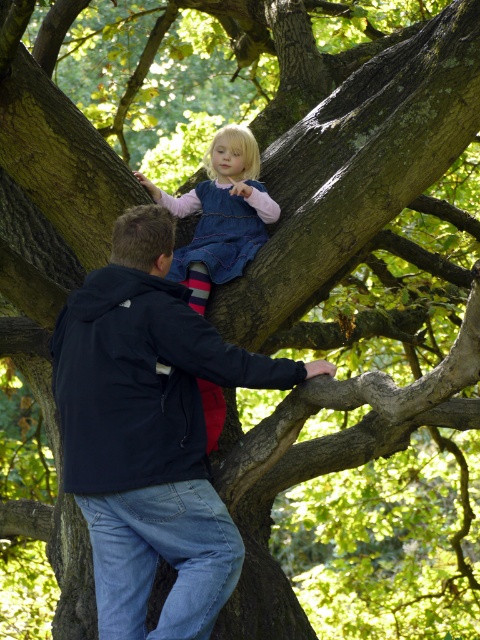
You are a photographer trying to capture a photo of the dark blue jacket at upper center and the denim dress at upper center. From the photographer perspective, which item is located to the right?

The dark blue jacket at upper center is positioned on the right side of denim dress at upper center, so from the photographer perspective, the dark blue jacket at upper center is located to the right of the denim dress at upper center.

You are a photographer standing at the base of the tree. You want to take a photo of the dark blue jacket at upper center and the denim dress at upper center so that both are in focus. The camera you are using has a depth of field that can cover 40 inches. Will both subjects be in focus?

The distance between the dark blue jacket at upper center and the denim dress at upper center is 35.80 inches, which is within the camera depth of field of 40 inches. Therefore, both subjects will be in focus.